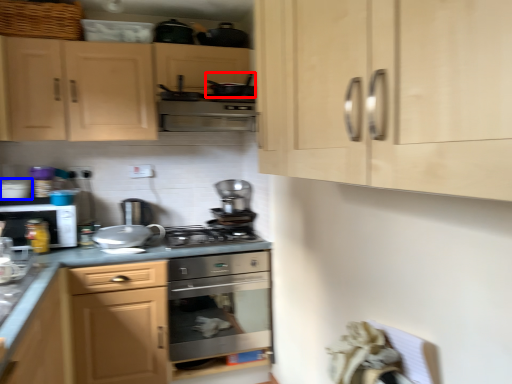
Question: Which object is closer to the camera taking this photo, appliance (highlighted by a red box) or appliance (highlighted by a blue box)?

Choices:
 (A) appliance
 (B) appliance

Answer: (A)